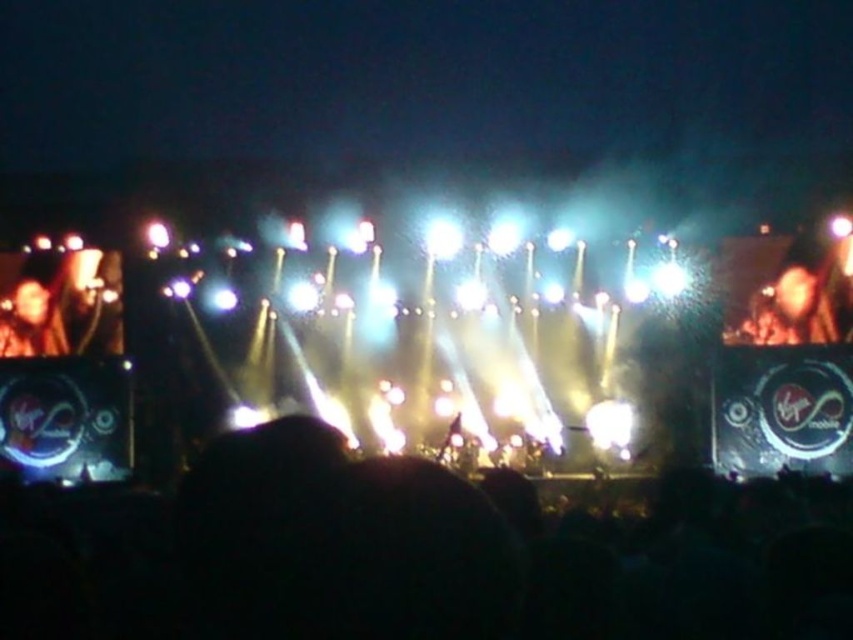
Question: Which point is farther to the camera?

Choices:
 (A) (820, 564)
 (B) (15, 292)

Answer: (B)

Question: Does black matte crowd at lower center come behind smooth skin face at left?

Choices:
 (A) no
 (B) yes

Answer: (A)

Question: Is black matte crowd at lower center to the right of dark brown leather jacket at upper right from the viewer's perspective?

Choices:
 (A) no
 (B) yes

Answer: (A)

Question: Which of the following is the closest to the observer?

Choices:
 (A) black matte crowd at lower center
 (B) dark brown leather jacket at upper right
 (C) smooth skin face at left

Answer: (A)

Question: Is dark brown leather jacket at upper right behind smooth skin face at left?

Choices:
 (A) yes
 (B) no

Answer: (B)

Question: Which object is closer to the camera taking this photo?

Choices:
 (A) smooth skin face at left
 (B) dark brown leather jacket at upper right

Answer: (B)